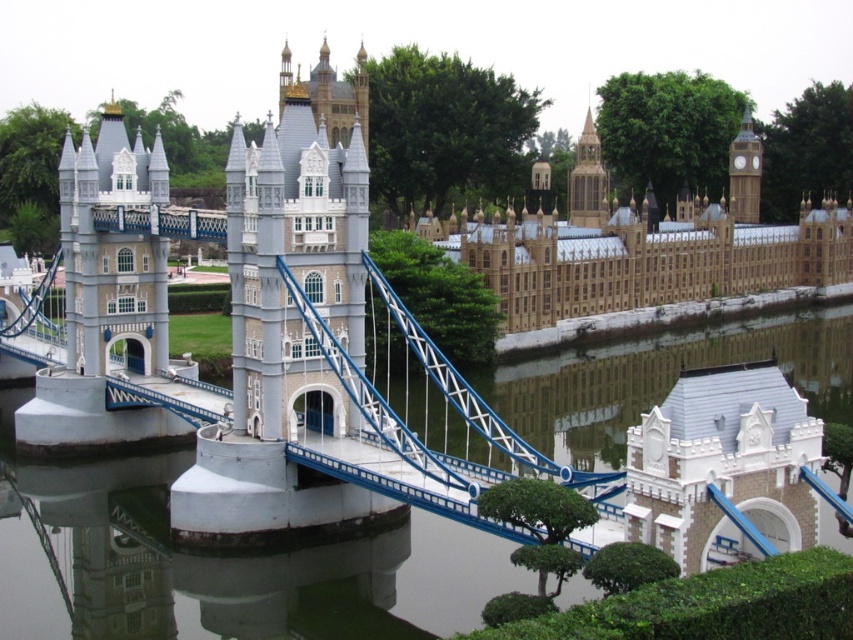
You are standing in front of the miniature Tower Bridge model at Legoland. You notice two points marked on the model. One is at coordinate point (x=541, y=289) and the other at point (x=741, y=220). Which of these two points is nearer to you?

Point (x=541, y=289) is closer to the viewer than point (x=741, y=220).

You are a model designer who wants to place a new decorative element between the golden stone tower at upper center and the golden stone clock tower at upper right. Which tower has a larger width to consider for spacing?

The golden stone tower at upper center has a larger width than the golden stone clock tower at upper right, so you should consider its width for spacing.